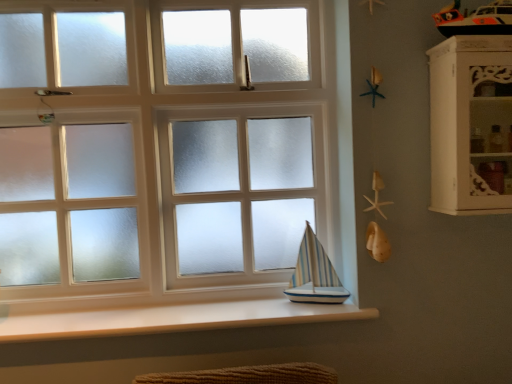
Question: Is white wood cabinet at right facing away from white frosted glass at center?

Choices:
 (A) yes
 (B) no

Answer: (B)

Question: Can you confirm if white wood cabinet at right is positioned to the left of white frosted glass at center?

Choices:
 (A) no
 (B) yes

Answer: (A)

Question: Does white wood cabinet at right turn towards white frosted glass at center?

Choices:
 (A) no
 (B) yes

Answer: (A)

Question: Is white wood cabinet at right with white frosted glass at center?

Choices:
 (A) yes
 (B) no

Answer: (B)

Question: Is white wood cabinet at right closer to the viewer compared to white frosted glass at center?

Choices:
 (A) no
 (B) yes

Answer: (B)

Question: Can you confirm if white wood cabinet at right is shorter than white frosted glass at center?

Choices:
 (A) yes
 (B) no

Answer: (A)

Question: Considering the relative sizes of white smooth wood at lower center and white wood cabinet at right in the image provided, is white smooth wood at lower center taller than white wood cabinet at right?

Choices:
 (A) yes
 (B) no

Answer: (B)

Question: Is white smooth wood at lower center oriented away from white wood cabinet at right?

Choices:
 (A) yes
 (B) no

Answer: (B)

Question: Is white smooth wood at lower center positioned far away from white wood cabinet at right?

Choices:
 (A) no
 (B) yes

Answer: (A)

Question: Would you say white wood cabinet at right is part of white smooth wood at lower center's contents?

Choices:
 (A) yes
 (B) no

Answer: (B)

Question: From a real-world perspective, is white smooth wood at lower center below white wood cabinet at right?

Choices:
 (A) yes
 (B) no

Answer: (A)

Question: Is white smooth wood at lower center positioned in front of white wood cabinet at right?

Choices:
 (A) no
 (B) yes

Answer: (A)

Question: From the image's perspective, is blue striped wood sailboat at lower center on top of white wood cabinet at right?

Choices:
 (A) yes
 (B) no

Answer: (B)